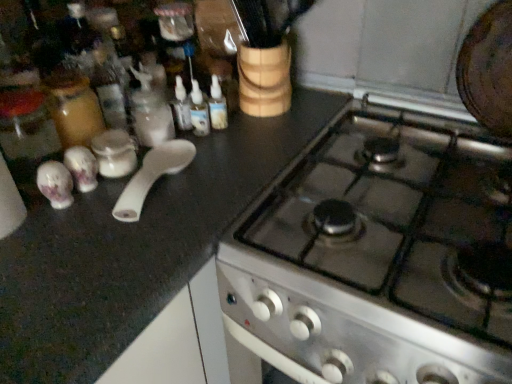
Question: Would you say metallic silver gas stove at center is part of white plastic spoon at left's contents?

Choices:
 (A) yes
 (B) no

Answer: (B)

Question: Can you confirm if white plastic spoon at left is smaller than metallic silver gas stove at center?

Choices:
 (A) no
 (B) yes

Answer: (B)

Question: Is white plastic spoon at left to the right of metallic silver gas stove at center from the viewer's perspective?

Choices:
 (A) no
 (B) yes

Answer: (A)

Question: Is white plastic spoon at left to the left of metallic silver gas stove at center from the viewer's perspective?

Choices:
 (A) no
 (B) yes

Answer: (B)

Question: Considering the relative sizes of white plastic spoon at left and metallic silver gas stove at center in the image provided, is white plastic spoon at left bigger than metallic silver gas stove at center?

Choices:
 (A) no
 (B) yes

Answer: (A)

Question: From the image's perspective, is white plastic spoon at left beneath metallic silver gas stove at center?

Choices:
 (A) yes
 (B) no

Answer: (B)

Question: Is translucent plastic bottles at center, the 2th bottle viewed from the right, to the left of white glossy salt and pepper shakers at left from the viewer's perspective?

Choices:
 (A) yes
 (B) no

Answer: (B)

Question: Is translucent plastic bottles at center, the 2th bottle viewed from the right, directly adjacent to white glossy salt and pepper shakers at left?

Choices:
 (A) no
 (B) yes

Answer: (A)

Question: Does translucent plastic bottles at center, the first bottle positioned from the left, appear on the right side of white glossy salt and pepper shakers at left?

Choices:
 (A) yes
 (B) no

Answer: (A)

Question: Does translucent plastic bottles at center, the first bottle positioned from the left, have a larger size compared to white glossy salt and pepper shakers at left?

Choices:
 (A) no
 (B) yes

Answer: (B)

Question: Is translucent plastic bottles at center, the 2th bottle viewed from the right, thinner than white glossy salt and pepper shakers at left?

Choices:
 (A) no
 (B) yes

Answer: (B)

Question: Is white glossy salt and pepper shakers at left completely or partially inside translucent plastic bottles at center, the first bottle positioned from the left?

Choices:
 (A) no
 (B) yes

Answer: (A)

Question: Is translucent plastic bottles at center, the 2th bottle viewed from the right, completely or partially outside of white plastic spoon at left?

Choices:
 (A) no
 (B) yes

Answer: (B)